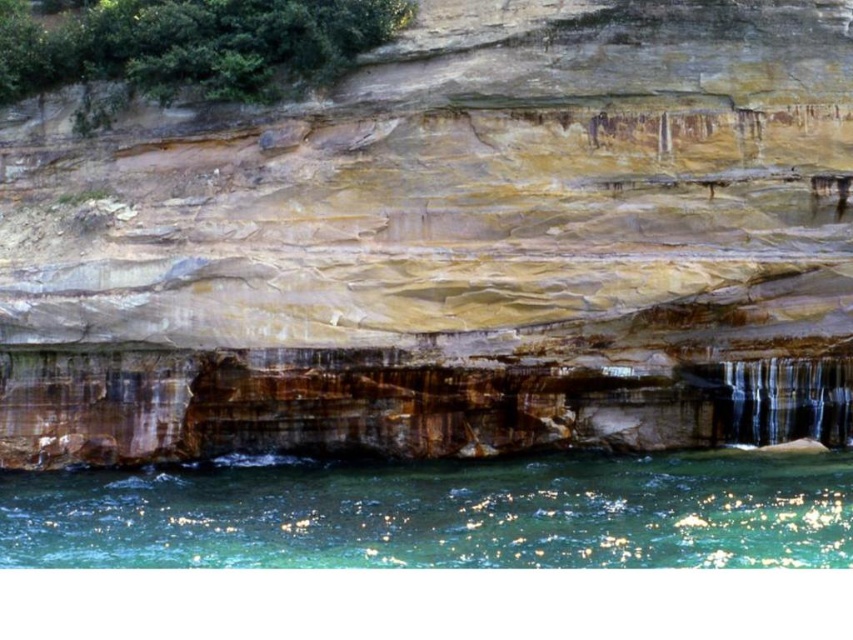
Question: Does rustic stone cliff at center appear over clear glass waterfall at lower right?

Choices:
 (A) no
 (B) yes

Answer: (B)

Question: Which point is closer to the camera?

Choices:
 (A) rustic stone cliff at center
 (B) clear glass water at lower center
 (C) clear glass waterfall at lower right

Answer: (B)

Question: Estimate the real-world distances between objects in this image. Which object is farther from the clear glass water at lower center?

Choices:
 (A) rustic stone cliff at center
 (B) clear glass waterfall at lower right

Answer: (B)

Question: Among these points, which one is farthest from the camera?

Choices:
 (A) (366, 298)
 (B) (769, 397)
 (C) (851, 520)

Answer: (B)

Question: In this image, where is rustic stone cliff at center located relative to clear glass waterfall at lower right?

Choices:
 (A) above
 (B) below

Answer: (A)

Question: Can you confirm if clear glass water at lower center is positioned below clear glass waterfall at lower right?

Choices:
 (A) no
 (B) yes

Answer: (B)